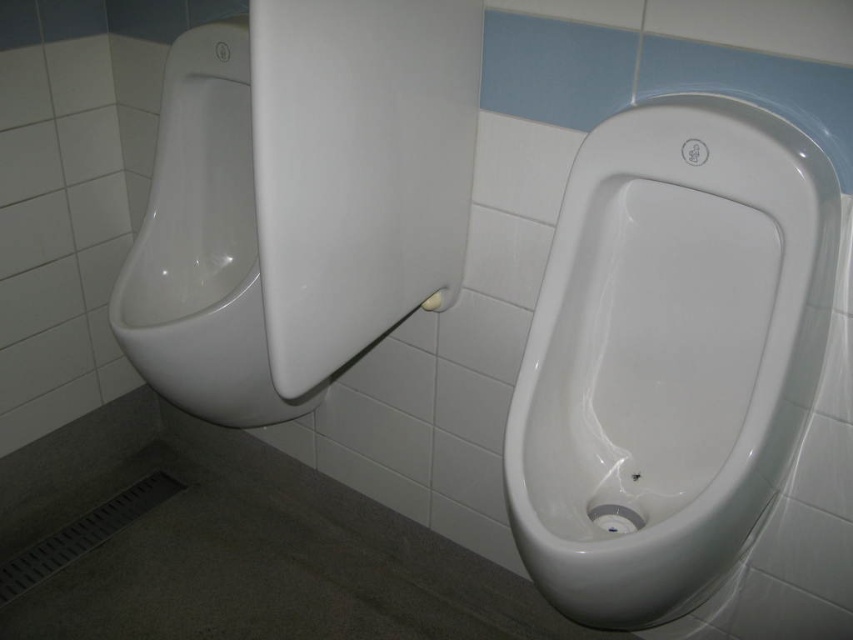
Question: Observing the image, what is the correct spatial positioning of white glossy urinal at center in reference to white glossy urinal at left?

Choices:
 (A) above
 (B) below

Answer: (B)

Question: Can you confirm if white glossy urinal at center is positioned below white glossy urinal at left?

Choices:
 (A) no
 (B) yes

Answer: (B)

Question: Observing the image, what is the correct spatial positioning of white glossy urinal at center in reference to white glossy urinal at left?

Choices:
 (A) right
 (B) left

Answer: (A)

Question: Which point is farther to the camera?

Choices:
 (A) (274, 404)
 (B) (641, 376)

Answer: (A)